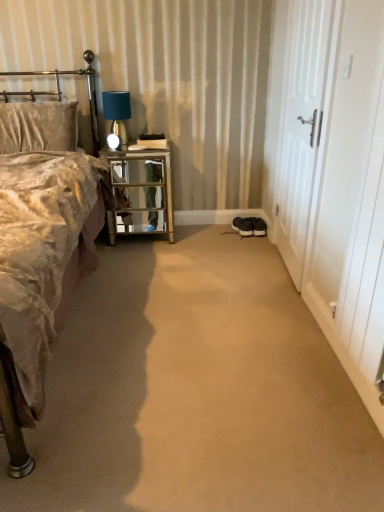
Question: Does matte blue glass table lamp at upper left have a larger size compared to white wooden screen door at right, the 2th screen door when ordered from back to front?

Choices:
 (A) no
 (B) yes

Answer: (A)

Question: Is matte blue glass table lamp at upper left further to camera compared to white wooden screen door at right, the 1th screen door viewed from the front?

Choices:
 (A) no
 (B) yes

Answer: (B)

Question: Is matte blue glass table lamp at upper left beside white wooden screen door at right, the 2th screen door when ordered from back to front?

Choices:
 (A) yes
 (B) no

Answer: (B)

Question: Does matte blue glass table lamp at upper left come in front of white wooden screen door at right, the 2th screen door when ordered from back to front?

Choices:
 (A) no
 (B) yes

Answer: (A)

Question: Is matte blue glass table lamp at upper left thinner than white wooden screen door at right, the 1th screen door viewed from the front?

Choices:
 (A) no
 (B) yes

Answer: (A)

Question: Is matte blue glass table lamp at upper left looking in the opposite direction of white wooden screen door at right, the 2th screen door when ordered from back to front?

Choices:
 (A) no
 (B) yes

Answer: (A)

Question: Does black suede sneakers at lower center have a smaller size compared to metallic gold headboard at upper left?

Choices:
 (A) no
 (B) yes

Answer: (B)

Question: Is black suede sneakers at lower center completely or partially outside of metallic gold headboard at upper left?

Choices:
 (A) no
 (B) yes

Answer: (B)

Question: Can you confirm if black suede sneakers at lower center is positioned to the right of metallic gold headboard at upper left?

Choices:
 (A) no
 (B) yes

Answer: (B)

Question: Are black suede sneakers at lower center and metallic gold headboard at upper left making contact?

Choices:
 (A) no
 (B) yes

Answer: (A)

Question: Can you confirm if black suede sneakers at lower center is wider than metallic gold headboard at upper left?

Choices:
 (A) no
 (B) yes

Answer: (A)

Question: Could you tell me if black suede sneakers at lower center is facing metallic gold headboard at upper left?

Choices:
 (A) yes
 (B) no

Answer: (B)

Question: Would you say metallic gold headboard at upper left is a long distance from velvet gold bed at left?

Choices:
 (A) no
 (B) yes

Answer: (B)